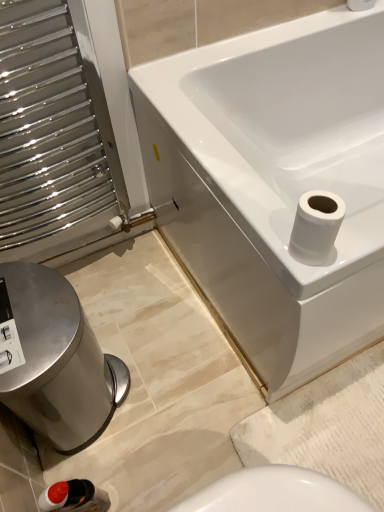
Image resolution: width=384 pixels, height=512 pixels. In order to click on empty space that is to the right of polished stainless steel bidet at lower left in this screenshot , I will do pos(172,391).